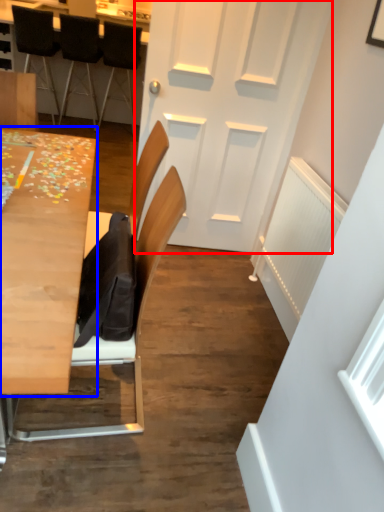
Question: Among these objects, which one is nearest to the camera, door (highlighted by a red box) or table (highlighted by a blue box)?

Choices:
 (A) door
 (B) table

Answer: (B)